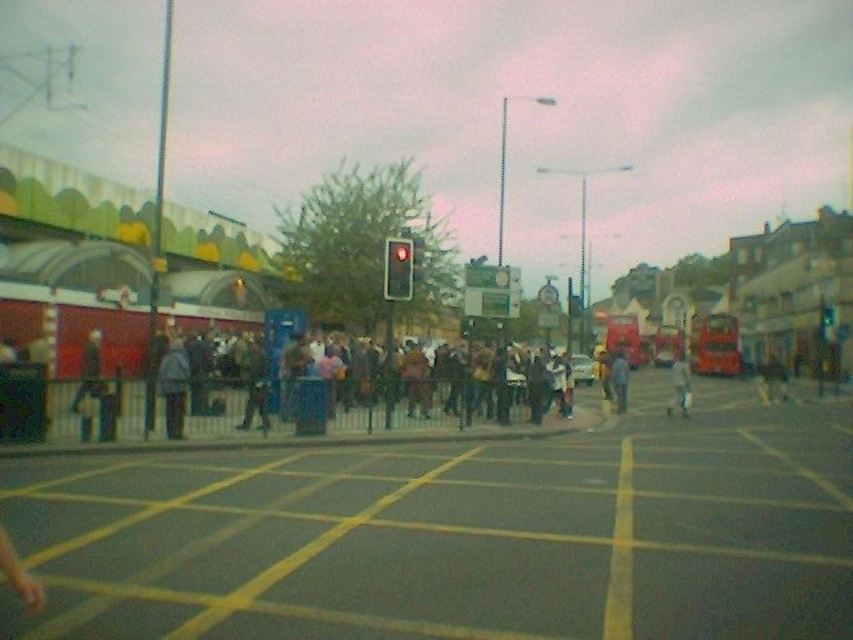
Is red metallic bus at center behind light gray jacket at center?

Yes, red metallic bus at center is further from the viewer.

Based on the photo, does red metallic bus at center appear on the right side of light gray jacket at center?

Correct, you'll find red metallic bus at center to the right of light gray jacket at center.

Measure the distance between red metallic bus at center and camera.

red metallic bus at center and camera are 58.37 meters apart from each other.

Locate an element on the screen. The height and width of the screenshot is (640, 853). red metallic bus at center is located at coordinates (714, 344).

Looking at this image, can you confirm if red metallic bus at center is positioned to the left of red glass traffic light at center?

Incorrect, red metallic bus at center is not on the left side of red glass traffic light at center.

Who is more forward, (714, 326) or (403, 269)?

Point (403, 269) is in front.

The width and height of the screenshot is (853, 640). I want to click on red metallic bus at center, so click(x=714, y=344).

Between brown fabric crowd at center and dark blue jacket at center, which one is positioned higher?

brown fabric crowd at center is above.

This screenshot has height=640, width=853. I want to click on brown fabric crowd at center, so click(271, 396).